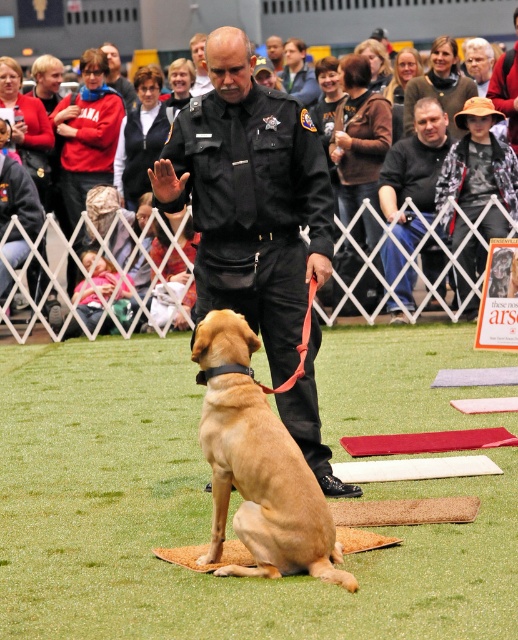
You are a photographer at the event and need to capture a photo that includes both the red cotton shirt at upper left and the golden fur dog at center. Based on their positions, which object should be placed on the left side of the photo frame?

The golden fur dog at center should be placed on the left side of the photo frame because the red cotton shirt at upper left is to the right of it.

In the scene shown: You are a photographer at the event and need to capture a clear photo of the black uniform at center without the red cotton shirt at upper left appearing in the background. Is this possible given their positions?

The black uniform at center is in front of the red cotton shirt at upper left, so you can take a photo focusing on the black uniform at center and the red cotton shirt at upper left will not be in the background since it is behind the black uniform at center.